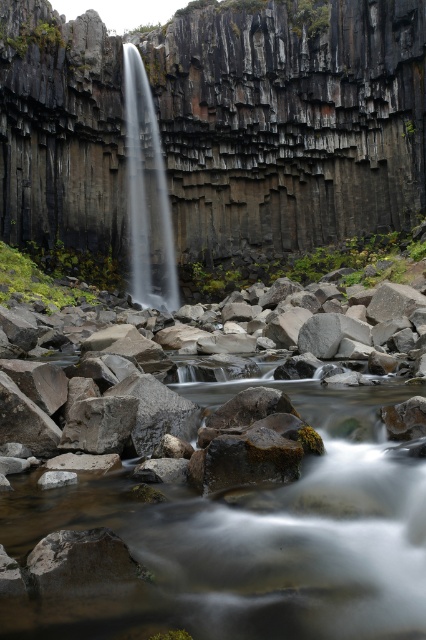
Question: Which point is farther from the camera taking this photo?

Choices:
 (A) tap(172, 51)
 (B) tap(143, 556)
 (C) tap(143, 220)

Answer: (C)

Question: Among these objects, which one is nearest to the camera?

Choices:
 (A) clear water at center
 (B) smooth rock stream at center

Answer: (B)

Question: Which object is closer to the camera taking this photo?

Choices:
 (A) dark gray basalt cliff at center
 (B) clear water at center
 (C) smooth rock stream at center

Answer: (C)

Question: Can you confirm if dark gray basalt cliff at center is smaller than smooth rock stream at center?

Choices:
 (A) yes
 (B) no

Answer: (B)

Question: Is dark gray basalt cliff at center wider than clear water at center?

Choices:
 (A) no
 (B) yes

Answer: (B)

Question: Can you confirm if dark gray basalt cliff at center is positioned below clear water at center?

Choices:
 (A) yes
 (B) no

Answer: (B)